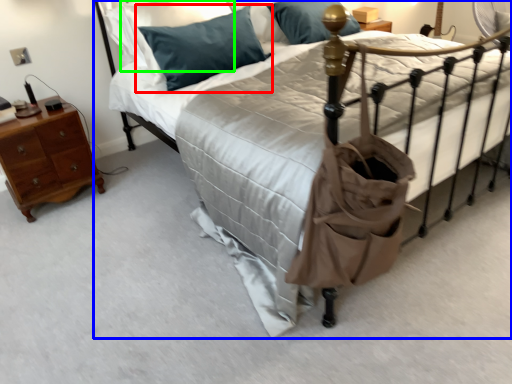
Question: Estimate the real-world distances between objects in this image. Which object is farther from pillow (highlighted by a red box), bed (highlighted by a blue box) or pillow (highlighted by a green box)?

Choices:
 (A) bed
 (B) pillow

Answer: (A)